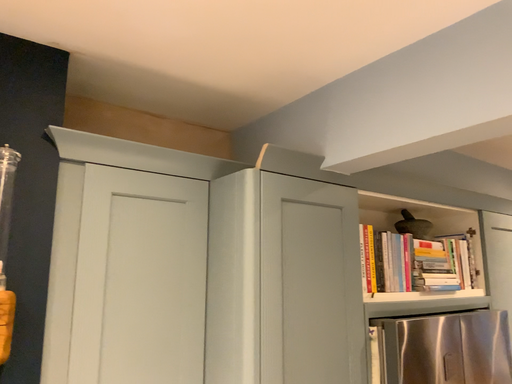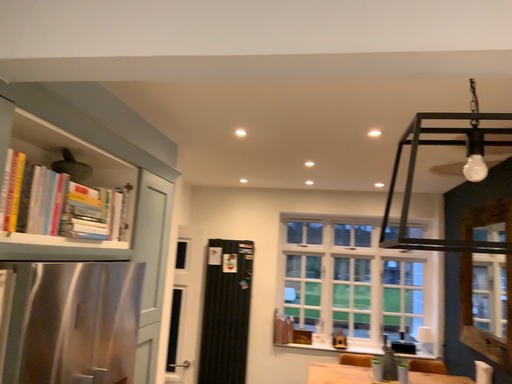
Question: Which way did the camera rotate in the video?

Choices:
 (A) rotated upward
 (B) rotated downward

Answer: (B)